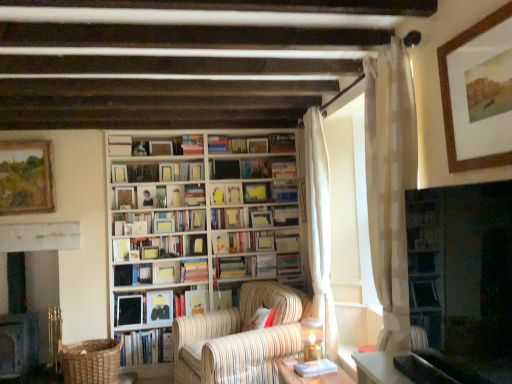
Identify the location of vacant point above wooden table at lower center (from a real-world perspective). The image size is (512, 384). (311, 371).